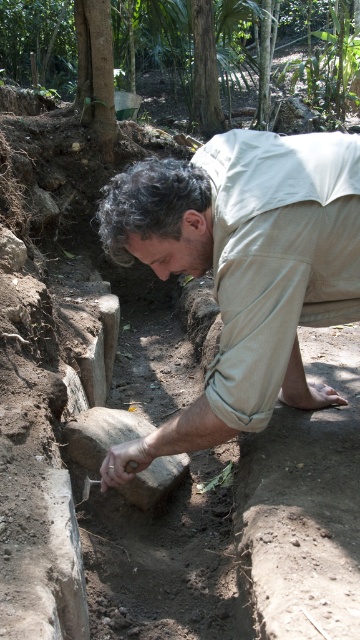
Which of these two, smooth gray stone at lower center or brown leather glove at lower center, stands taller?

smooth gray stone at lower center

What are the coordinates of `smooth gray stone at lower center` in the screenshot? It's located at 101,435.

Identify the location of smooth gray stone at lower center. The image size is (360, 640). (101, 435).

Can you confirm if beige cotton shirt at center is taller than brown leather glove at lower center?

Yes.

Does point (303, 316) lie behind point (102, 483)?

No, it is not.

Image resolution: width=360 pixels, height=640 pixels. Identify the location of beige cotton shirt at center. (246, 259).

Is beige cotton shirt at center smaller than smooth gray stone at lower center?

Incorrect, beige cotton shirt at center is not smaller in size than smooth gray stone at lower center.

In the scene shown: Who is positioned more to the right, beige cotton shirt at center or smooth gray stone at lower center?

beige cotton shirt at center

Measure the distance between point (335, 147) and camera.

The distance of point (335, 147) from camera is 1.60 meters.

Where is `beige cotton shirt at center`? The width and height of the screenshot is (360, 640). beige cotton shirt at center is located at coordinates (246, 259).